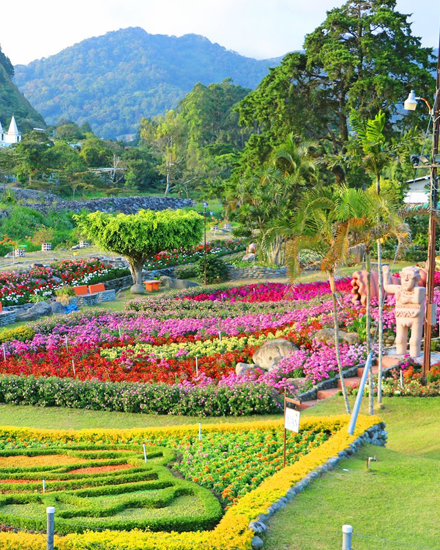
Where is `stairs`? The width and height of the screenshot is (440, 550). stairs is located at coordinates (384, 355).